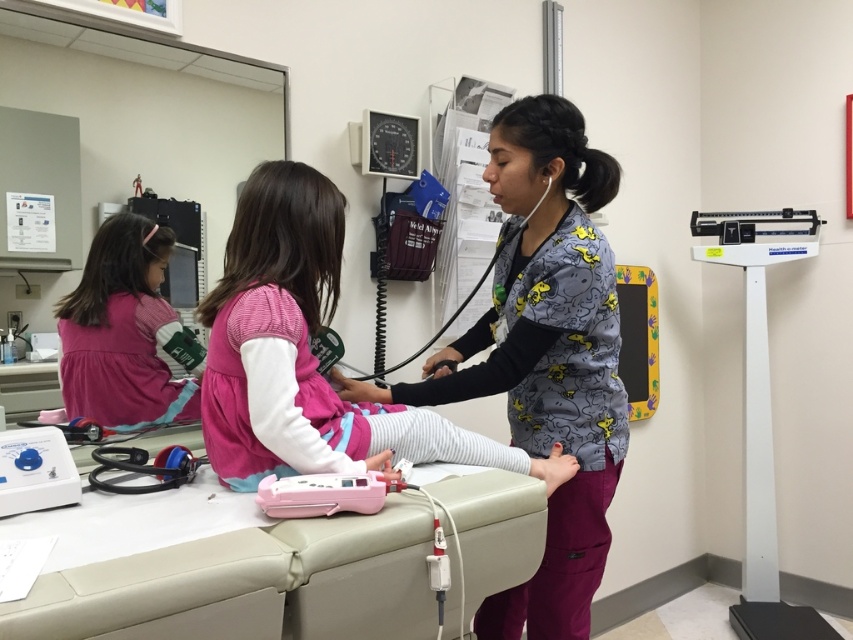
Is white plastic scale at right below matte plastic stethoscope at lower left?

Yes.

Is point (730, 250) positioned in front of point (0, 460)?

No, it is behind (0, 460).

Where is `white plastic scale at right`? This screenshot has width=853, height=640. white plastic scale at right is located at coordinates (759, 412).

Looking at this image, who is more forward, (485, 340) or (57, 449)?

Point (57, 449) is in front.

Does gray printed scrubs at center have a greater width compared to matte plastic stethoscope at lower left?

Yes, gray printed scrubs at center is wider than matte plastic stethoscope at lower left.

Which is in front, point (540, 340) or point (61, 499)?

Point (61, 499) is more forward.

At what (x,y) coordinates should I click in order to perform the action: click on gray printed scrubs at center. Please return your answer as a coordinate pair (x, y). Looking at the image, I should click on (544, 355).

Does point (281, 164) lie in front of point (49, 448)?

No, it is not.

Does pink fabric dress at center have a greater width compared to matte plastic stethoscope at lower left?

Correct, the width of pink fabric dress at center exceeds that of matte plastic stethoscope at lower left.

Find the location of a particular element. The image size is (853, 640). pink fabric dress at center is located at coordinates (306, 353).